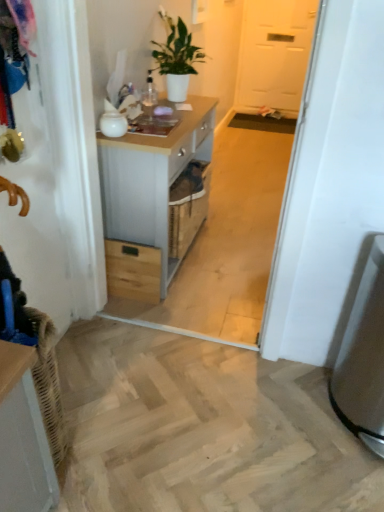
Question: Is white matte door at upper center surrounded by satin silver trash can at lower right?

Choices:
 (A) no
 (B) yes

Answer: (A)

Question: Is satin silver trash can at lower right to the left of white matte door at upper center from the viewer's perspective?

Choices:
 (A) yes
 (B) no

Answer: (A)

Question: Does satin silver trash can at lower right appear on the right side of white matte door at upper center?

Choices:
 (A) yes
 (B) no

Answer: (B)

Question: From a real-world perspective, is satin silver trash can at lower right on top of white matte door at upper center?

Choices:
 (A) yes
 (B) no

Answer: (B)

Question: Does satin silver trash can at lower right have a greater height compared to white matte door at upper center?

Choices:
 (A) yes
 (B) no

Answer: (B)

Question: Can you confirm if satin silver trash can at lower right is smaller than white matte door at upper center?

Choices:
 (A) yes
 (B) no

Answer: (A)

Question: Is satin silver trash can at lower right shorter than white wood chest of drawers at center?

Choices:
 (A) yes
 (B) no

Answer: (A)

Question: From the image's perspective, is satin silver trash can at lower right over white wood chest of drawers at center?

Choices:
 (A) no
 (B) yes

Answer: (A)

Question: Is satin silver trash can at lower right wider than white wood chest of drawers at center?

Choices:
 (A) yes
 (B) no

Answer: (A)

Question: Is satin silver trash can at lower right at the left side of white wood chest of drawers at center?

Choices:
 (A) no
 (B) yes

Answer: (A)

Question: Does satin silver trash can at lower right turn towards white wood chest of drawers at center?

Choices:
 (A) yes
 (B) no

Answer: (B)

Question: Considering the relative sizes of satin silver trash can at lower right and white wood chest of drawers at center in the image provided, is satin silver trash can at lower right taller than white wood chest of drawers at center?

Choices:
 (A) no
 (B) yes

Answer: (A)

Question: Can you confirm if white matte plant at upper center is positioned to the left of satin silver trash can at lower right?

Choices:
 (A) yes
 (B) no

Answer: (A)